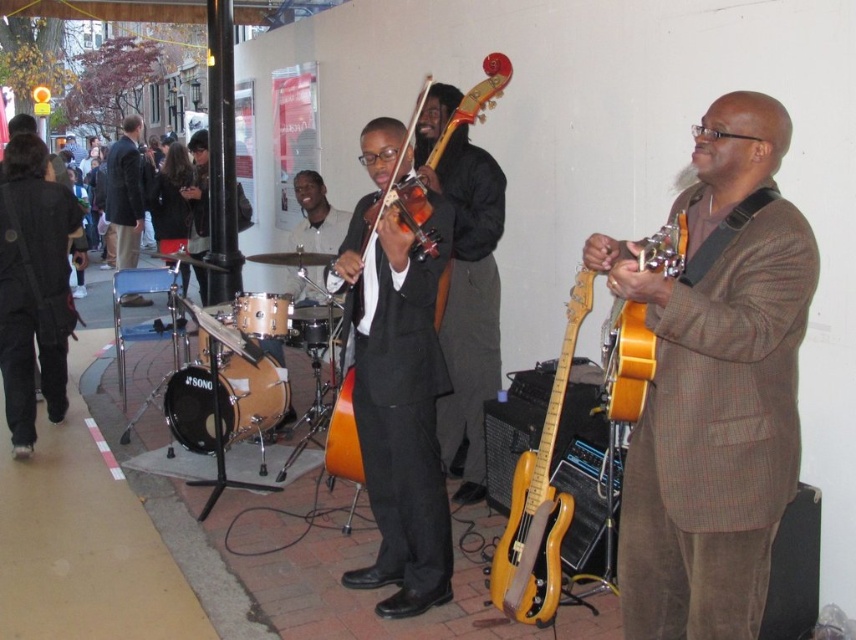
You are a photographer trying to capture a clear shot of the orange glossy guitar at center and the wooden drum at center. Based on their positions, which one is positioned lower in the image?

The orange glossy guitar at center is located below the wooden drum at center, so the orange glossy guitar at center is positioned lower in the image.